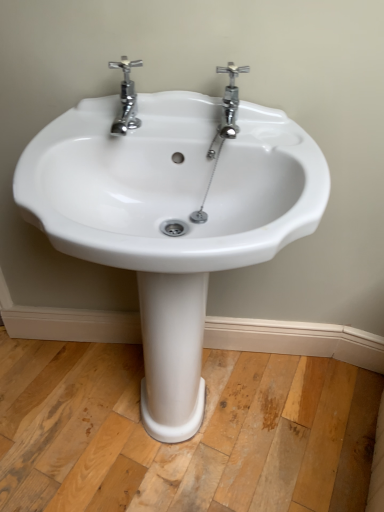
Locate an element on the screen. The width and height of the screenshot is (384, 512). vacant area located to the right-hand side of white ceramic sink at center is located at coordinates (317, 420).